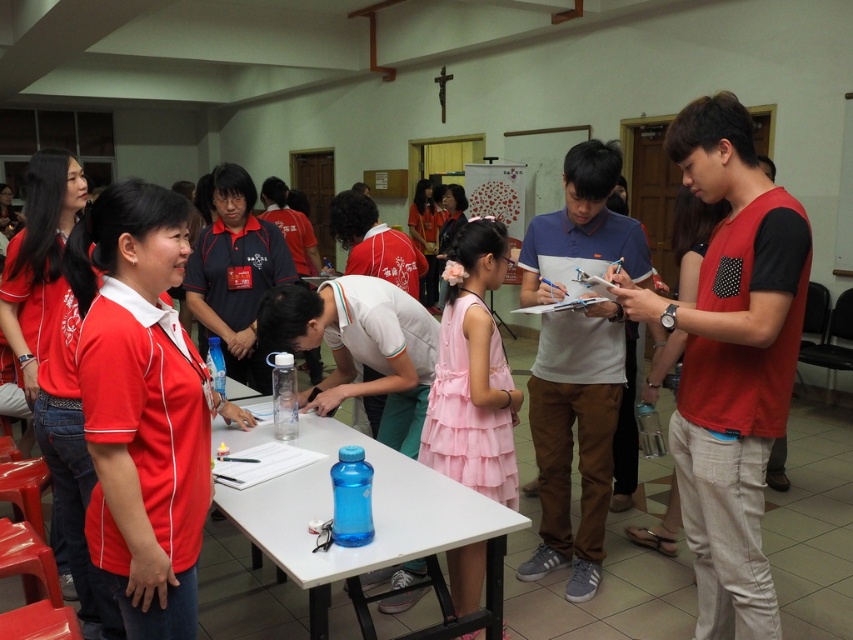
Does blue plastic table at center come behind pink satin dress at center?

No, it is in front of pink satin dress at center.

Is blue plastic table at center to the right of pink satin dress at center from the viewer's perspective?

No, blue plastic table at center is not to the right of pink satin dress at center.

Which is in front, point (347, 426) or point (485, 269)?

Point (485, 269) is more forward.

Where is `blue plastic table at center`? The width and height of the screenshot is (853, 640). blue plastic table at center is located at coordinates (373, 522).

Is point (460, 516) closer to camera compared to point (552, 304)?

Yes, point (460, 516) is closer to viewer.

Is point (244, 445) positioned after point (537, 278)?

No, it is in front of (537, 278).

Image resolution: width=853 pixels, height=640 pixels. What do you see at coordinates (373, 522) in the screenshot? I see `blue plastic table at center` at bounding box center [373, 522].

Image resolution: width=853 pixels, height=640 pixels. Identify the location of blue plastic table at center. (373, 522).

Is pink satin dress at center above white paper at center?

No.

Which is more to the right, pink satin dress at center or white paper at center?

Positioned to the right is white paper at center.

Is point (492, 476) farther from camera compared to point (561, 289)?

No, (492, 476) is closer to viewer.

You are a GUI agent. You are given a task and a screenshot of the screen. Output one action in this format:
    pyautogui.click(x=<x>, y=<y>)
    Task: Click on the pink satin dress at center
    
    Given the screenshot: What is the action you would take?
    pyautogui.click(x=473, y=372)